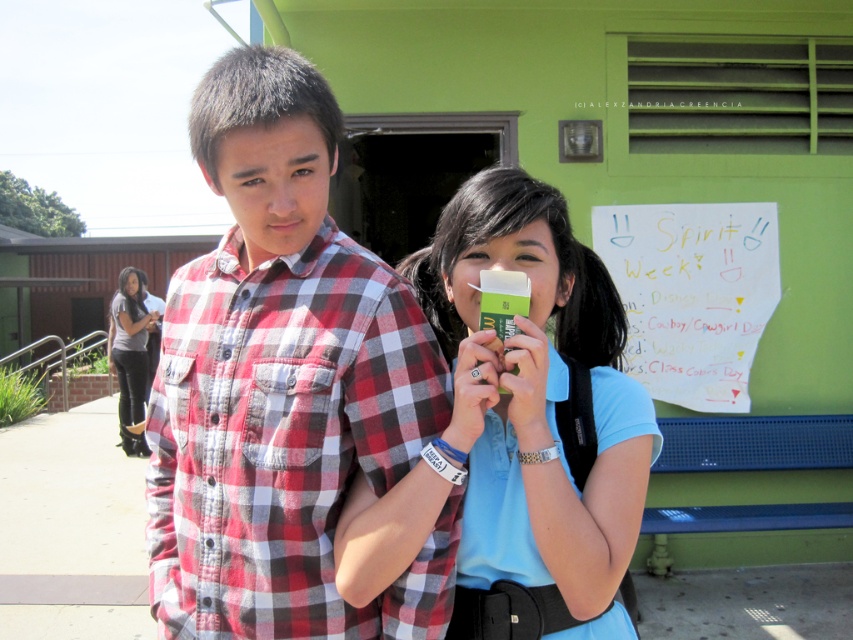
Question: Is white paper at upper right positioned in front of dark gray jeans at lower left?

Choices:
 (A) no
 (B) yes

Answer: (B)

Question: Can you confirm if plaid cotton shirt at center is bigger than dark gray jeans at lower left?

Choices:
 (A) no
 (B) yes

Answer: (A)

Question: Which of the following is the farthest from the observer?

Choices:
 (A) white paper at upper right
 (B) dark gray jeans at lower left

Answer: (B)

Question: Is plaid cotton shirt at center wider than white paper at upper right?

Choices:
 (A) yes
 (B) no

Answer: (B)

Question: Among these points, which one is nearest to the camera?

Choices:
 (A) (131, 348)
 (B) (161, 371)
 (C) (590, 484)

Answer: (C)

Question: Estimate the real-world distances between objects in this image. Which object is closer to the dark gray jeans at lower left?

Choices:
 (A) white paper at upper right
 (B) plaid cotton shirt at center
 (C) matte green eraser at center

Answer: (A)